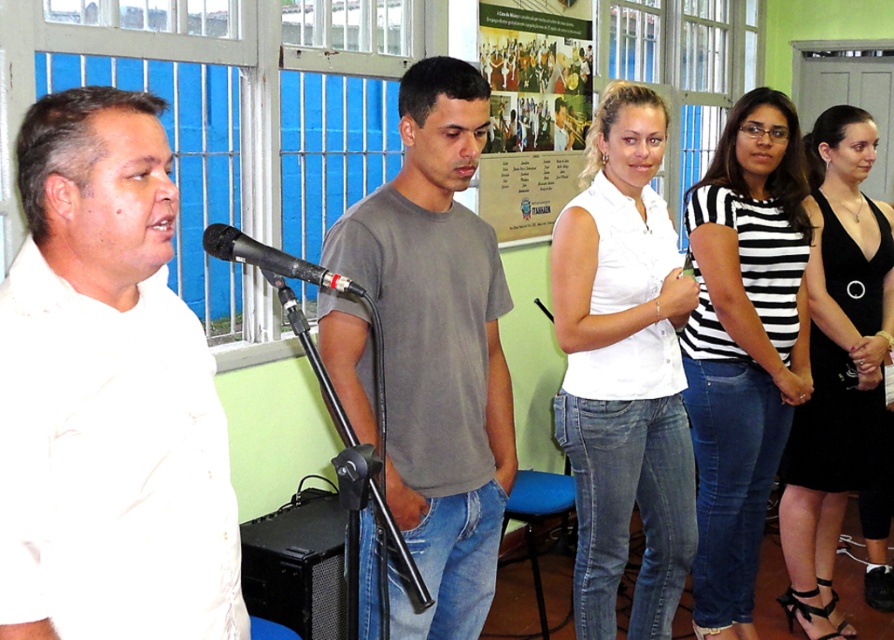
You are a photographer setting up for a group photo. You need to ensure that the black and white striped shirt at center and the black satin dress at right are both in focus. Given that your camera has a depth of field that can cover 14 inches, will you be able to capture both subjects clearly?

The black and white striped shirt at center is 13.86 inches away from the black satin dress at right. Since the distance between them is within the camera depth of field of 14 inches, both subjects will be in focus.

Based on the scene described, which object is positioned to the left of the other? The black and white striped shirt at center and the black satin dress at right are both present in the image. Please determine their spatial relationship.

The black and white striped shirt at center is positioned to the left of the black satin dress at right.

You are attending a meeting and need to hand a document to the person closest to you. Which person should you approach between the white matte shirt at left and the black satin dress at right?

You should approach the white matte shirt at left because it is closer to the viewer than the black satin dress at right.